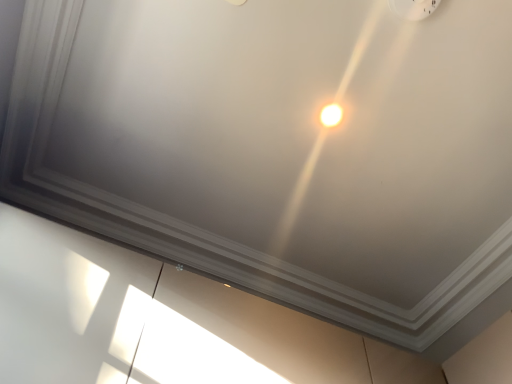
This screenshot has width=512, height=384. What do you see at coordinates (331, 115) in the screenshot?
I see `white glossy light bulb at upper center` at bounding box center [331, 115].

Locate an element on the screen. white glossy light bulb at upper center is located at coordinates 331,115.

This screenshot has height=384, width=512. In order to click on white glossy light bulb at upper center in this screenshot , I will do `click(331, 115)`.